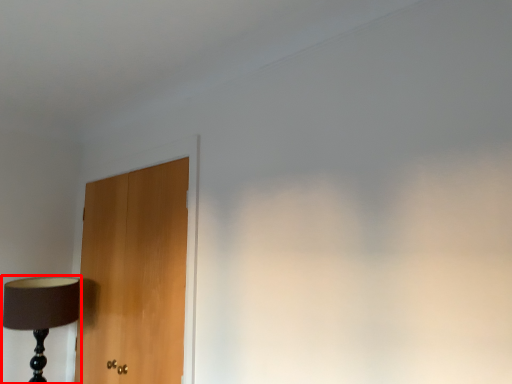
Question: Where is lamp (annotated by the red box) located in relation to door in the image?

Choices:
 (A) left
 (B) right

Answer: (A)